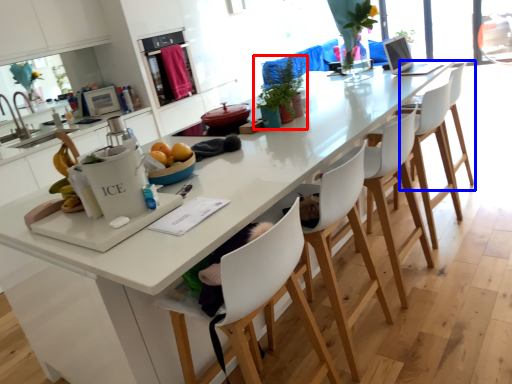
Question: Which object is further to the camera taking this photo, houseplant (highlighted by a red box) or chair (highlighted by a blue box)?

Choices:
 (A) houseplant
 (B) chair

Answer: (B)